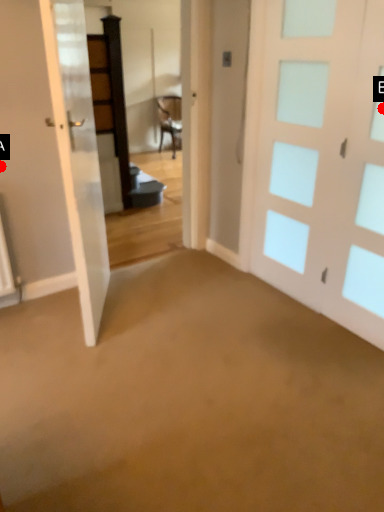
Question: Two points are circled on the image, labeled by A and B beside each circle. Which point appears closest to the camera in this image?

Choices:
 (A) A is closer
 (B) B is closer

Answer: (B)